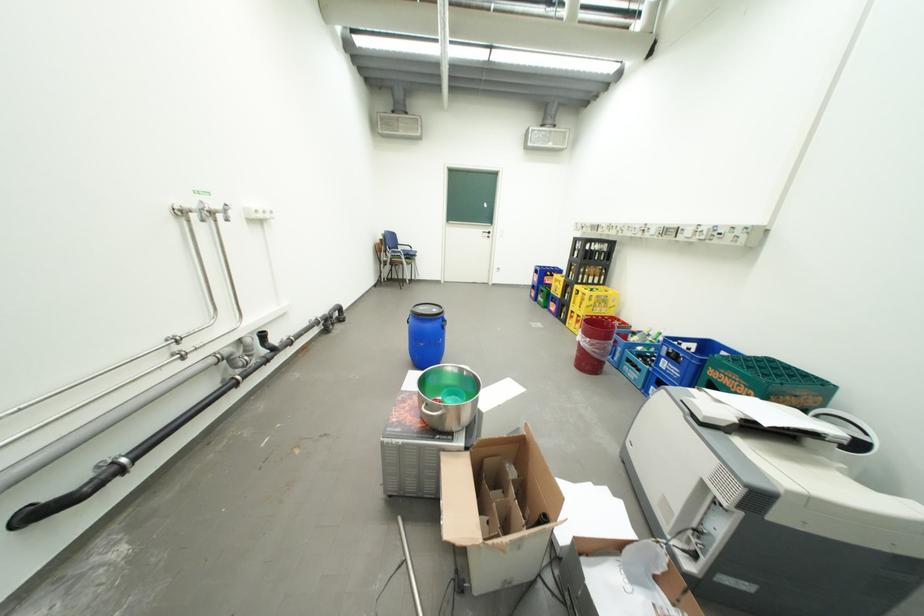
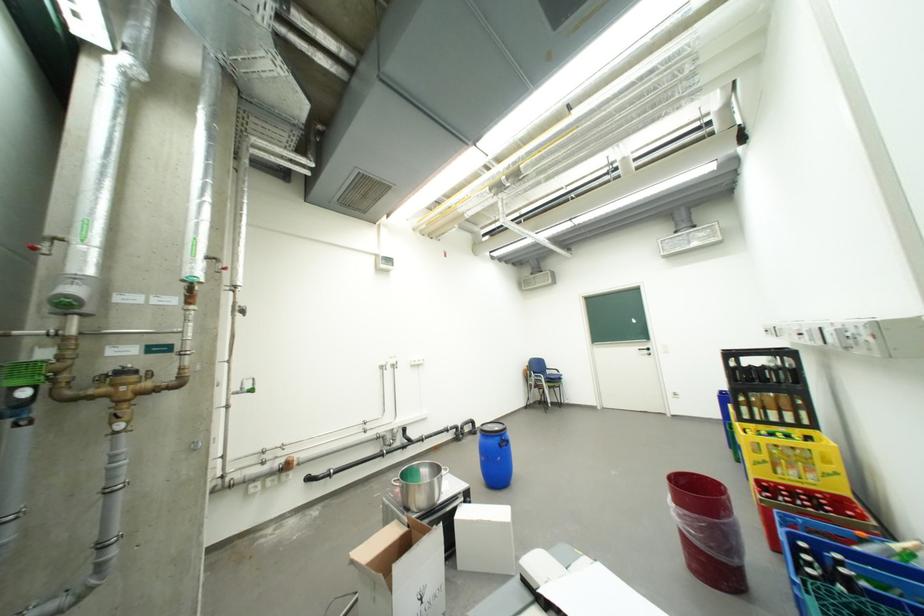
Find the pixel in the second image that matches (599,341) in the first image.

(685, 507)